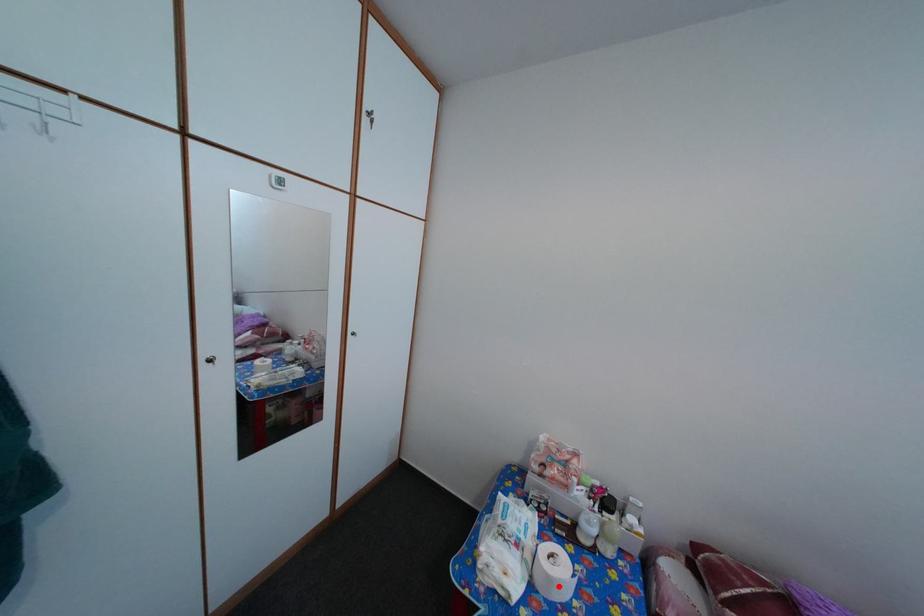
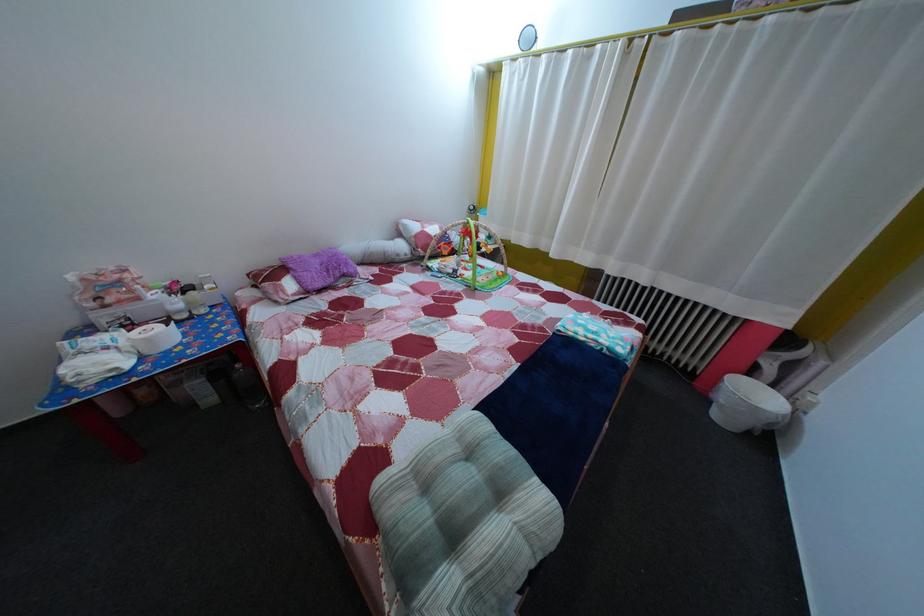
In the second image, find the point that corresponds to the highlighted location in the first image.

(157, 347)